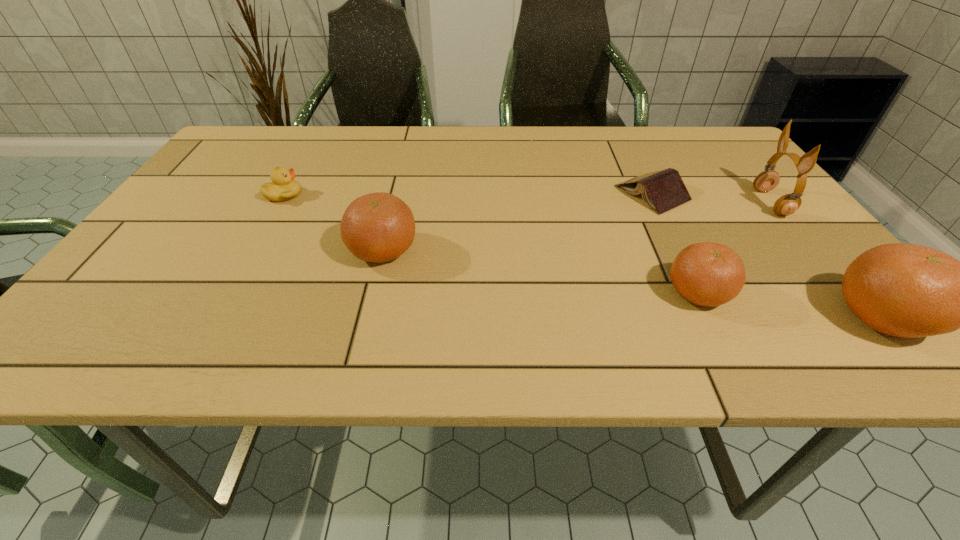
What are the coordinates of `vacant spot for a new clementine to ensure equal spacing` in the screenshot? It's located at (533, 270).